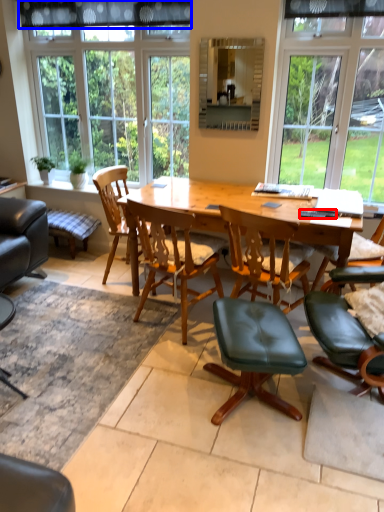
Question: Which of the following is the farthest to the observer, remote control (highlighted by a red box) or curtain (highlighted by a blue box)?

Choices:
 (A) remote control
 (B) curtain

Answer: (B)